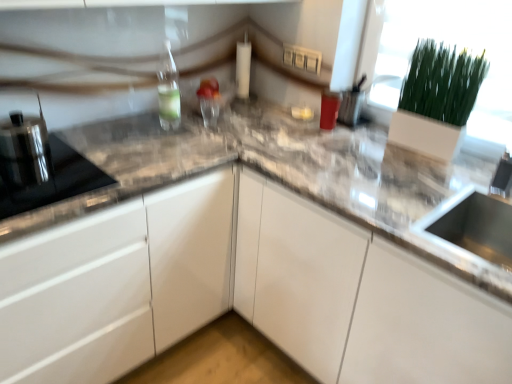
Where is `free space above black glass cooktop at left, which appears as the third appliance when viewed from the back (from a real-world perspective)`? The image size is (512, 384). free space above black glass cooktop at left, which appears as the third appliance when viewed from the back (from a real-world perspective) is located at coordinates (30, 167).